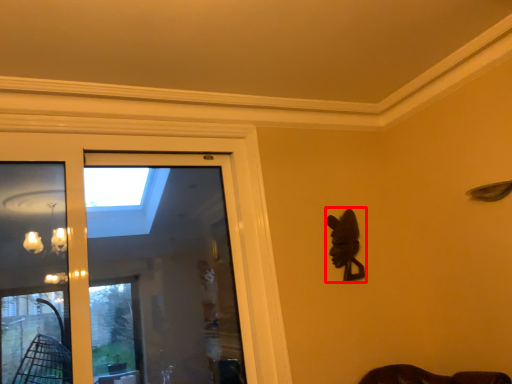
Question: Where is animal (annotated by the red box) located in relation to screen door in the image?

Choices:
 (A) left
 (B) right

Answer: (B)